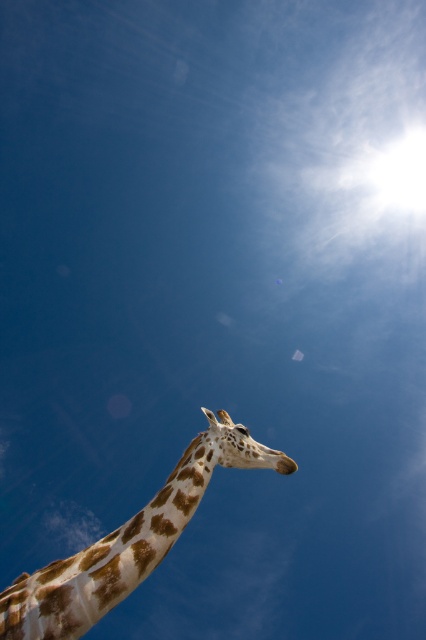
You are a photographer trying to capture the giraffe in the image. You notice the spotted fur giraffe at lower left and the spotted fur giraffe head at center. Which of these two objects is positioned more to the left side of the image?

The spotted fur giraffe at lower left is positioned more to the left side of the image compared to the spotted fur giraffe head at center.

You are a photographer taking a picture of the giraffe. You notice two points in the image labeled as point 1 at coordinates point (x=101, y=595) and point 2 at coordinates point (x=241, y=435). Which point is closer to the camera?

Point (x=101, y=595) is closer to the camera than point (x=241, y=435).

You are standing in a field and see a giraffe. There is a point at coordinates point (48, 637) that is 3.42 meters away from you. Can you estimate how far the giraffe is from you?

The distance between point (48, 637) and the viewer is 3.42 meters. Since the point is part of the giraffe, the giraffe is approximately 3.42 meters away from you.